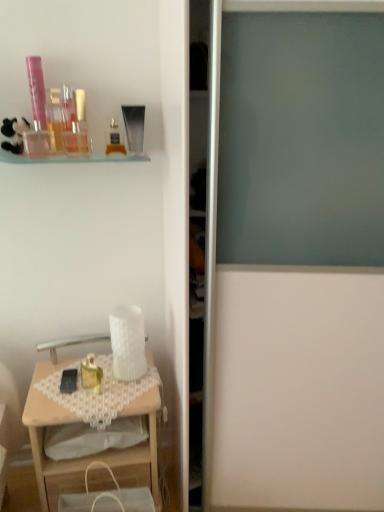
Question: From the image's perspective, relative to gold metallic perfume at lower left, which is the 8th toiletry in top-to-bottom order, is wooden desk at lower left above or below?

Choices:
 (A) below
 (B) above

Answer: (A)

Question: Is wooden desk at lower left situated inside gold metallic perfume at lower left, which is the 8th toiletry in top-to-bottom order, or outside?

Choices:
 (A) outside
 (B) inside

Answer: (A)

Question: Estimate the real-world distances between objects in this image. Which object is farther from the white fabric handbag at lower left?

Choices:
 (A) clear plastic bottle at upper left, which ranks as the 7th toiletry in bottom-to-top order
 (B) translucent glass perfume bottle at upper center, which is counted as the third toiletry, starting from the bottom
 (C) pink plastic tube at upper left, which is the 8th toiletry from bottom to top
 (D) matte plastic perfume bottle at upper left, placed as the seventh toiletry when sorted from top to bottom
 (E) white matte screen door at center

Answer: (C)

Question: Which object is positioned farthest from the black matte mobile phone at lower left?

Choices:
 (A) translucent plastic container at upper left, arranged as the 4th toiletry when ordered from the bottom
 (B) pink plastic tube at upper left, which is the 8th toiletry from bottom to top
 (C) transparent plastic tube at upper center, arranged as the fifth toiletry when ordered from the bottom
 (D) matte gold perfume at upper left, which is counted as the third toiletry, starting from the top
 (E) matte plastic perfume bottle at upper left, the 2th toiletry when ordered from bottom to top

Answer: (B)